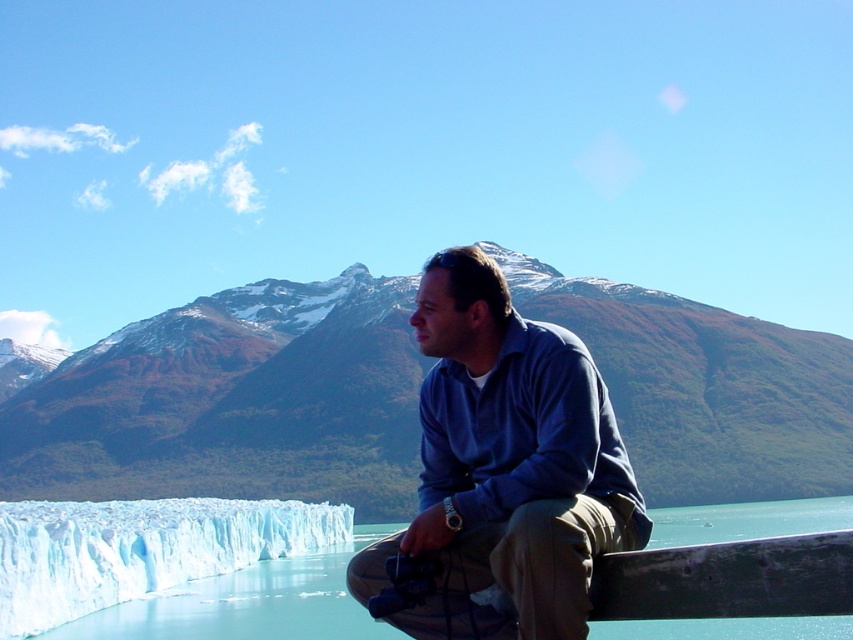
You are a hiker planning to take a photo of the snowy rocky mountain at center and the transparent ice water at lower left. Based on their positions, which object will appear larger in your camera frame?

The snowy rocky mountain at center will appear larger in the camera frame because it is closer to the viewer than the transparent ice water at lower left.

You are standing in the same spot as the man in the image and want to take a photo of the snowy rocky mountain at center and the blue cotton shirt at center. Which object should you point your camera towards first to capture both in the same frame?

You should point your camera towards the blue cotton shirt at center first because the snowy rocky mountain at center is located to its left, allowing both to be captured in the same frame by centering the shirt and including the mountain on the left side.

You are a hiker planning to take a photo of the snowy rocky mountain at center and the blue cotton shirt at center. Based on their sizes in the image, which object would appear larger in your photo?

The snowy rocky mountain at center would appear larger in the photo because it is much taller than the blue cotton shirt at center.